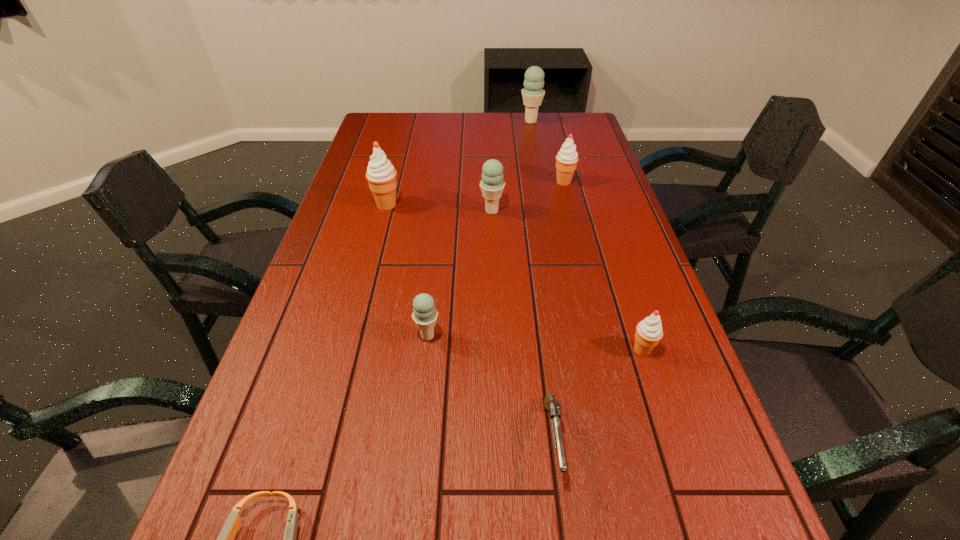
Locate which blue ice cream is the second closest to the second red icecream from left to right. Please provide its 2D coordinates. Your answer should be formatted as a tuple, i.e. [(x, y)], where the tuple contains the x and y coordinates of a point satisfying the conditions above.

[(533, 94)]

I want to click on the closest red icecream to the smallest red icecream, so click(566, 160).

Select which red icecream is the third closest to the sixth object from right to left. Please provide its 2D coordinates. Your answer should be formatted as a tuple, i.e. [(x, y)], where the tuple contains the x and y coordinates of a point satisfying the conditions above.

[(566, 160)]

Identify the location of vacant space that satisfies the following two spatial constraints: 1. on the front side of the rightmost ice cream; 2. on the right side of the fourth object from left to right. click(x=496, y=350).

Where is `vacant point that satisfies the following two spatial constraints: 1. on the front side of the second farthest red icecream; 2. on the left side of the third object from left to right`? Image resolution: width=960 pixels, height=540 pixels. vacant point that satisfies the following two spatial constraints: 1. on the front side of the second farthest red icecream; 2. on the left side of the third object from left to right is located at coordinates (352, 336).